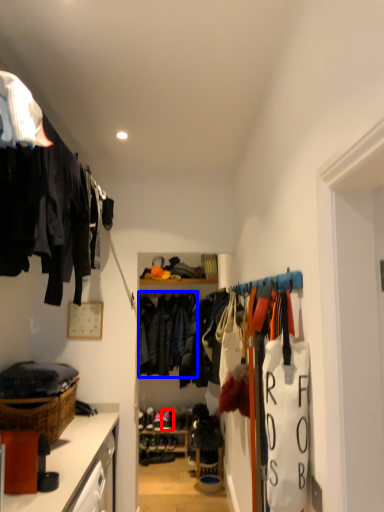
Question: Which point is closer to the camera, footwear (highlighted by a red box) or clothing (highlighted by a blue box)?

Choices:
 (A) footwear
 (B) clothing

Answer: (B)